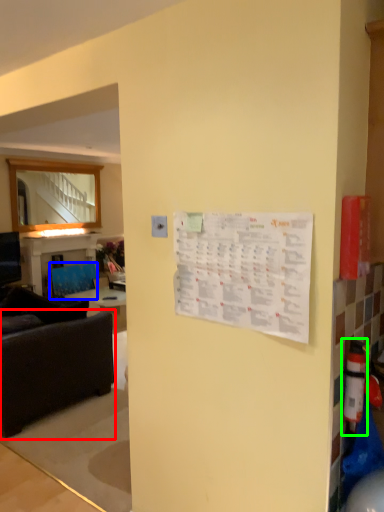
Question: Based on their relative distances, which object is nearer to studio couch (highlighted by a red box)? Choose from armchair (highlighted by a blue box) and extinguisher (highlighted by a green box).

Choices:
 (A) armchair
 (B) extinguisher

Answer: (A)